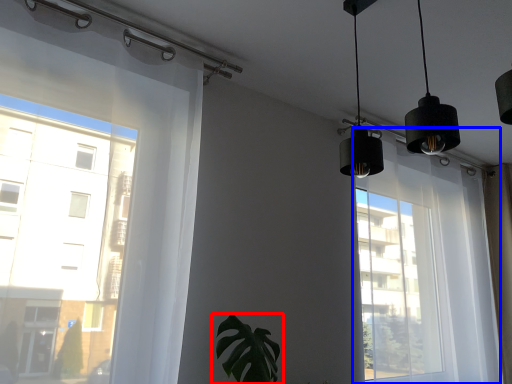
Question: Which of the following is the closest to the observer, houseplant (highlighted by a red box) or bay window (highlighted by a blue box)?

Choices:
 (A) houseplant
 (B) bay window

Answer: (A)